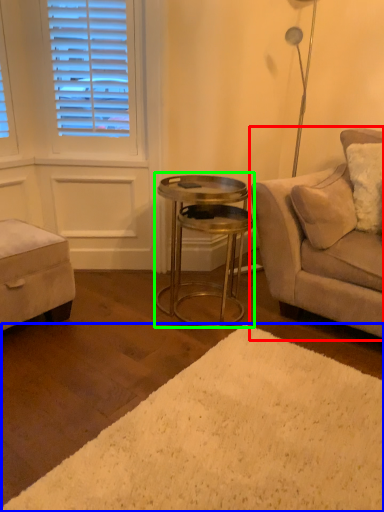
Question: Which is farther away from studio couch (highlighted by a red box)? plain (highlighted by a blue box) or table (highlighted by a green box)?

Choices:
 (A) plain
 (B) table

Answer: (A)